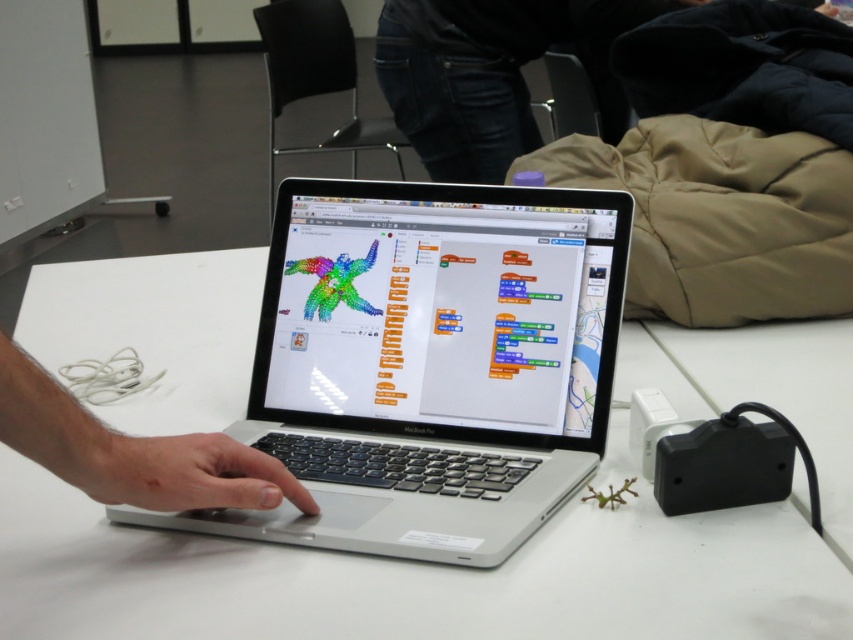
Question: Can you confirm if silver metallic laptop at center is thinner than matte black hand at center?

Choices:
 (A) yes
 (B) no

Answer: (B)

Question: Estimate the real-world distances between objects in this image. Which object is closer to the white glossy table at center?

Choices:
 (A) silver metallic laptop at center
 (B) matte black hand at center

Answer: (A)

Question: Which is nearer to the white glossy table at center?

Choices:
 (A) silver metallic laptop at center
 (B) matte black hand at center

Answer: (A)

Question: Does white glossy table at center appear on the left side of silver metallic laptop at center?

Choices:
 (A) no
 (B) yes

Answer: (B)

Question: Which point is closer to the camera?

Choices:
 (A) matte black hand at center
 (B) silver metallic laptop at center

Answer: (A)

Question: Can you confirm if silver metallic laptop at center is positioned to the left of matte black hand at center?

Choices:
 (A) no
 (B) yes

Answer: (A)